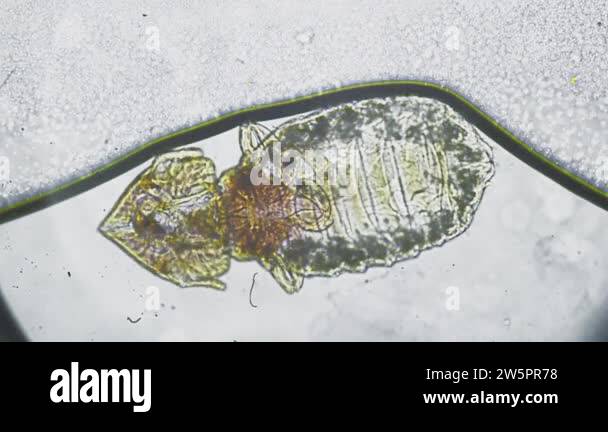
Locate an element on the screen. gray specks in white countertop is located at coordinates (551, 265), (380, 301), (582, 310).